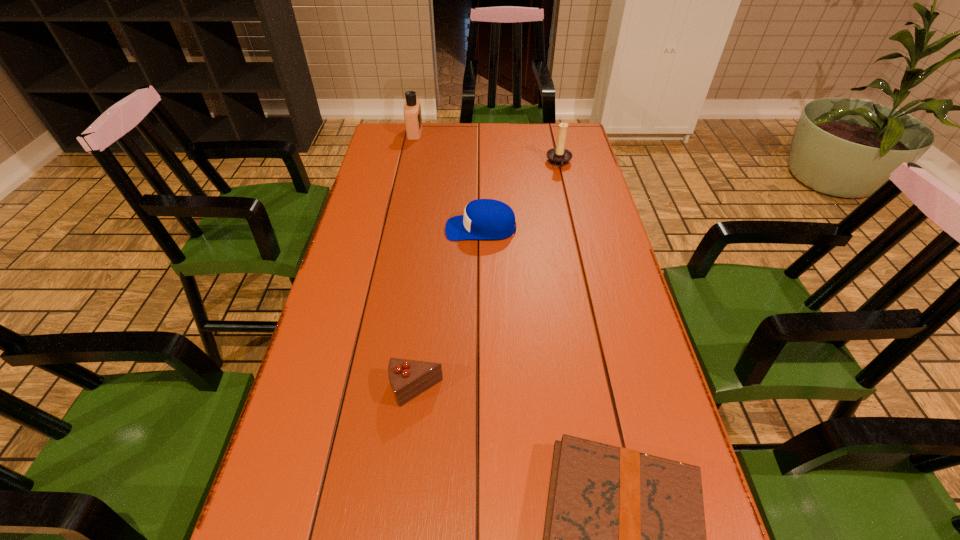
At what (x,y) coordinates should I click in order to perform the action: click on vacant area in the image that satisfies the following two spatial constraints: 1. on the front label of the farthest object; 2. on the right side of the chocolate cake. Please return your answer as a coordinate pair (x, y). Looking at the image, I should click on (361, 390).

The width and height of the screenshot is (960, 540). Identify the location of free location that satisfies the following two spatial constraints: 1. on the wick of the candle holder; 2. on the front side of the chocolate cake. (611, 390).